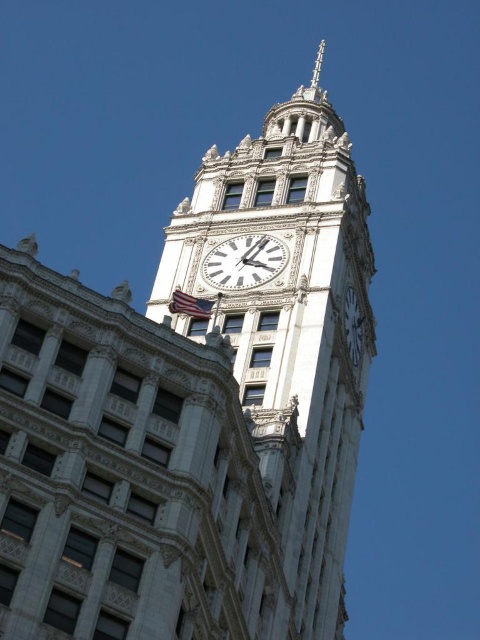
Question: Which point appears farthest from the camera in this image?

Choices:
 (A) (322, 54)
 (B) (282, 259)
 (C) (337, 384)
 (D) (197, 308)

Answer: (A)

Question: Can you confirm if white glossy clock at center is bigger than white stone clock at upper center?

Choices:
 (A) no
 (B) yes

Answer: (A)

Question: Is white stone clock tower at center in front of american flag at center?

Choices:
 (A) yes
 (B) no

Answer: (A)

Question: Is the position of white stone clock tower at center less distant than that of white glossy clock at center?

Choices:
 (A) no
 (B) yes

Answer: (B)

Question: Which point is closer to the camera taking this photo?

Choices:
 (A) (320, 44)
 (B) (201, 307)
 (C) (254, 250)
 (D) (264, 216)

Answer: (B)

Question: Which object is closer to the camera taking this photo?

Choices:
 (A) white stone clock tower at center
 (B) white stone clock at upper center

Answer: (A)